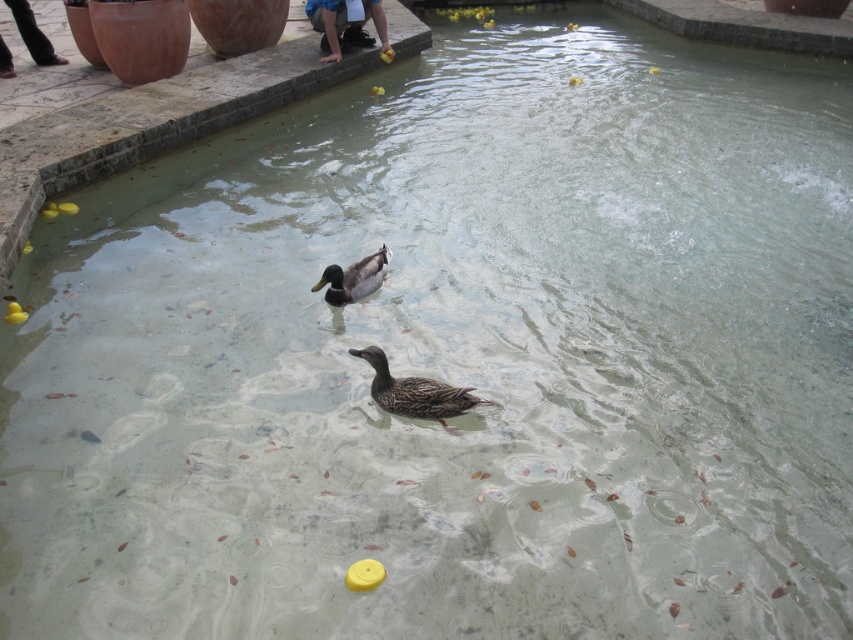
Is point (416, 412) farther from viewer compared to point (323, 280)?

No, (416, 412) is closer to viewer.

Does brown matte duck at center have a lesser height compared to shiny brown duck at center?

Indeed, brown matte duck at center has a lesser height compared to shiny brown duck at center.

At what (x,y) coordinates should I click in order to perform the action: click on brown matte duck at center. Please return your answer as a coordinate pair (x, y). The image size is (853, 640). Looking at the image, I should click on (415, 392).

This screenshot has height=640, width=853. What are the coordinates of `brown matte duck at center` in the screenshot? It's located at (415, 392).